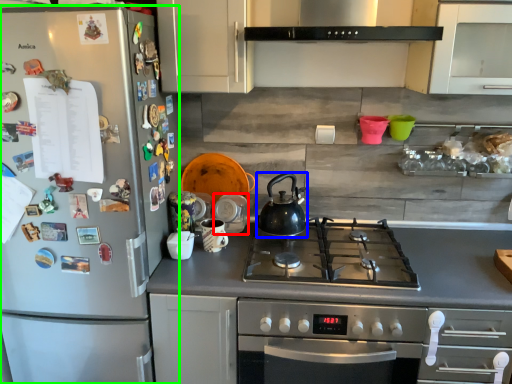
Question: Which object is positioned farthest from appliance (highlighted by a red box)? Select from kettle (highlighted by a blue box) and refrigerator (highlighted by a green box).

Choices:
 (A) kettle
 (B) refrigerator

Answer: (B)